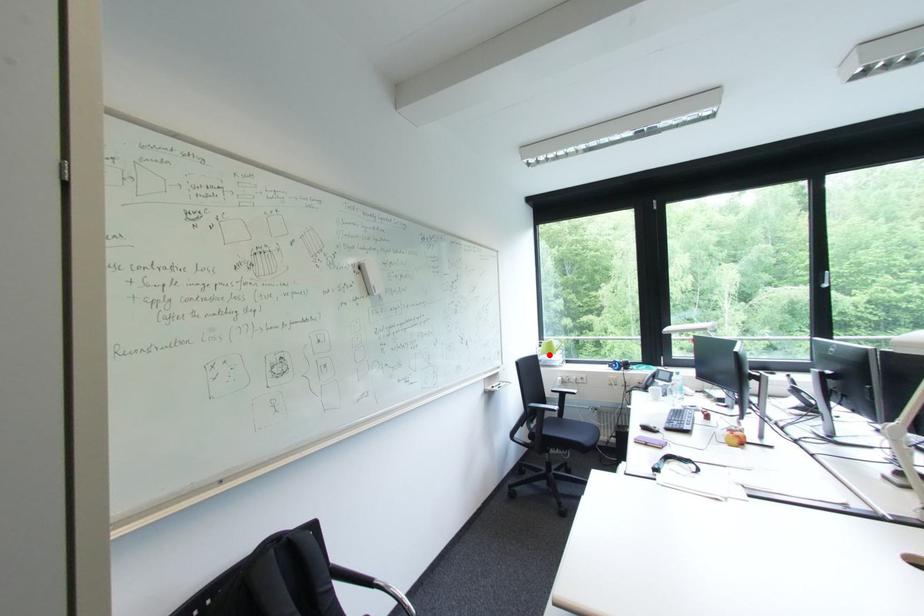
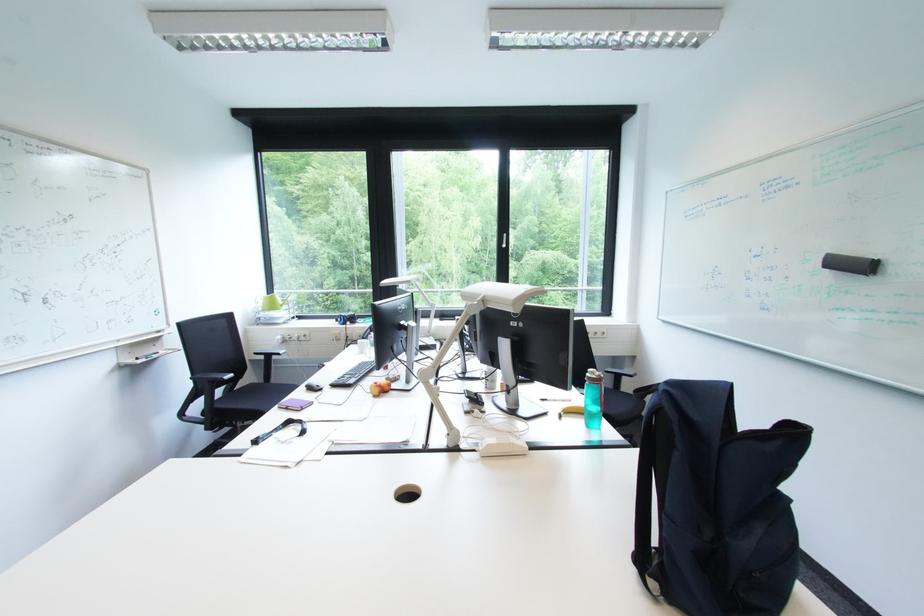
The point at the highlighted location is marked in the first image. Where is the corresponding point in the second image?

(270, 310)